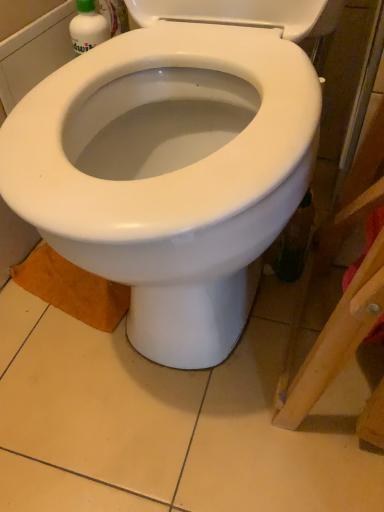
Identify the location of white glossy toilet at center. Image resolution: width=384 pixels, height=512 pixels. (173, 163).

Describe the element at coordinates (173, 163) in the screenshot. The height and width of the screenshot is (512, 384). I see `white glossy toilet at center` at that location.

Identify the location of white glossy toilet at center. The height and width of the screenshot is (512, 384). (173, 163).